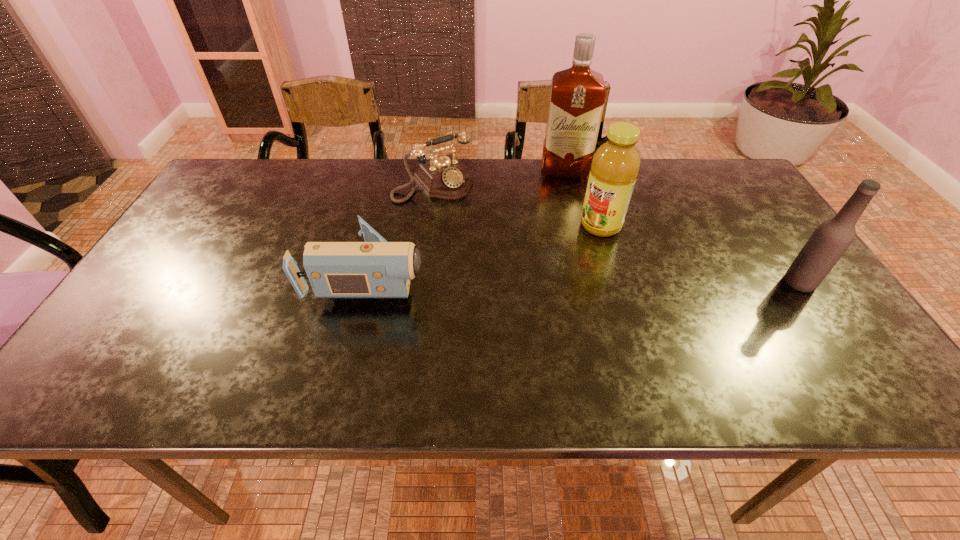
The height and width of the screenshot is (540, 960). I want to click on vacant space at the left edge, so click(157, 261).

In the image, there is a desktop. Where is `free space at the right edge`? The height and width of the screenshot is (540, 960). free space at the right edge is located at coordinates (766, 274).

Image resolution: width=960 pixels, height=540 pixels. In order to click on free space at the far right corner of the desktop in this screenshot , I will do `click(715, 159)`.

The height and width of the screenshot is (540, 960). What are the coordinates of `vacant region at the near right corner of the desktop` in the screenshot? It's located at (810, 334).

Identify the location of empty location between the telephone and the camcorder. (402, 229).

You are a GUI agent. You are given a task and a screenshot of the screen. Output one action in this format:
    pyautogui.click(x=<x>, y=<y>)
    Task: Click on the vacant area that lies between the tallest object and the telephone
    Image resolution: width=960 pixels, height=540 pixels.
    Given the screenshot: What is the action you would take?
    pyautogui.click(x=499, y=177)

Locate an element on the screen. Image resolution: width=960 pixels, height=540 pixels. free point between the third farthest object and the camcorder is located at coordinates (486, 250).

Locate an element on the screen. vacant area that lies between the telephone and the camcorder is located at coordinates (402, 229).

The height and width of the screenshot is (540, 960). I want to click on free space between the camcorder and the rightmost object, so click(x=585, y=279).

Where is `vacant region between the camcorder and the liquor`? The height and width of the screenshot is (540, 960). vacant region between the camcorder and the liquor is located at coordinates (468, 222).